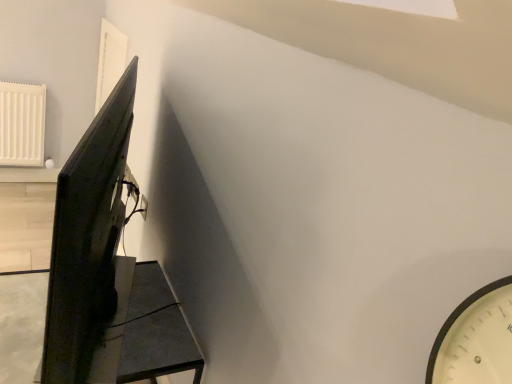
Question: From a real-world perspective, is matte black monitor at left above or below white plastic electric outlet at upper center?

Choices:
 (A) below
 (B) above

Answer: (B)

Question: Looking at their shapes, would you say matte black monitor at left is wider or thinner than white plastic electric outlet at upper center?

Choices:
 (A) thin
 (B) wide

Answer: (B)

Question: Considering the real-world distances, which object is closest to the white plastic electric outlet at upper center?

Choices:
 (A) matte black table at lower left
 (B) matte black monitor at left

Answer: (A)

Question: Which object is positioned closest to the white plastic electric outlet at upper center?

Choices:
 (A) matte black monitor at left
 (B) matte black table at lower left

Answer: (B)